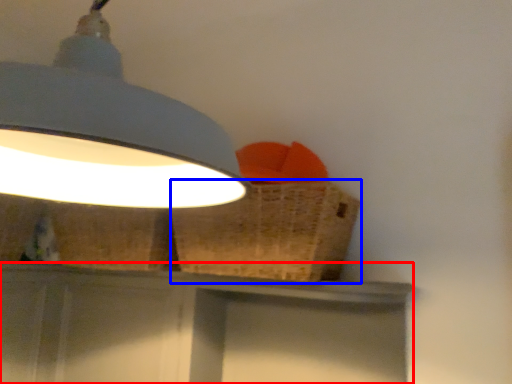
Question: Which object is further to the camera taking this photo, vanity (highlighted by a red box) or basket (highlighted by a blue box)?

Choices:
 (A) vanity
 (B) basket

Answer: (A)